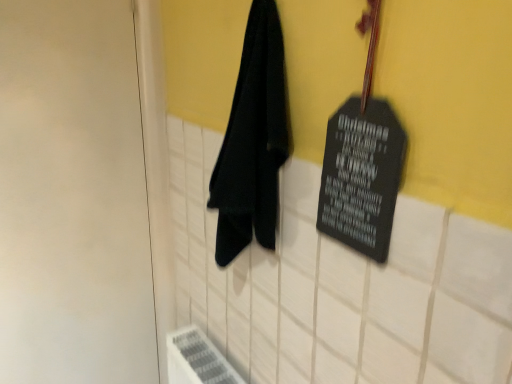
Question: Does black matte sign at upper right have a lesser width compared to black fabric towel at center?

Choices:
 (A) yes
 (B) no

Answer: (A)

Question: Is the surface of black matte sign at upper right in direct contact with black fabric towel at center?

Choices:
 (A) yes
 (B) no

Answer: (B)

Question: Is black matte sign at upper right outside black fabric towel at center?

Choices:
 (A) no
 (B) yes

Answer: (B)

Question: Is black matte sign at upper right wider than black fabric towel at center?

Choices:
 (A) yes
 (B) no

Answer: (B)

Question: Does black matte sign at upper right have a lesser height compared to black fabric towel at center?

Choices:
 (A) no
 (B) yes

Answer: (B)

Question: Is black matte sign at upper right further to camera compared to black fabric towel at center?

Choices:
 (A) no
 (B) yes

Answer: (A)

Question: Does black matte sign at upper right have a larger size compared to white matte door at left?

Choices:
 (A) no
 (B) yes

Answer: (A)

Question: Does black matte sign at upper right have a greater height compared to white matte door at left?

Choices:
 (A) no
 (B) yes

Answer: (A)

Question: Is black matte sign at upper right smaller than white matte door at left?

Choices:
 (A) yes
 (B) no

Answer: (A)

Question: Can you confirm if black matte sign at upper right is positioned to the left of white matte door at left?

Choices:
 (A) no
 (B) yes

Answer: (A)

Question: Is black matte sign at upper right facing towards white matte door at left?

Choices:
 (A) yes
 (B) no

Answer: (B)

Question: Is black matte sign at upper right at the right side of white matte door at left?

Choices:
 (A) no
 (B) yes

Answer: (B)

Question: Considering the relative sizes of white matte door at left and black fabric towel at center in the image provided, is white matte door at left shorter than black fabric towel at center?

Choices:
 (A) yes
 (B) no

Answer: (B)